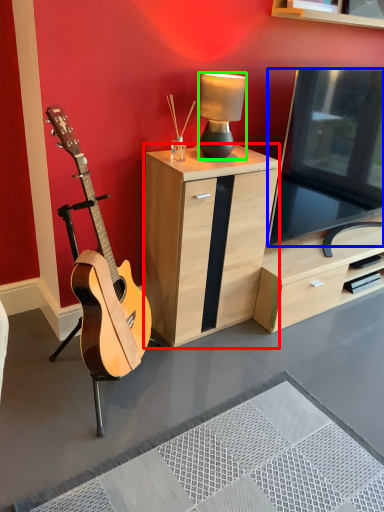
Question: Considering the real-world distances, which object is farthest from cabinetry (highlighted by a red box)? television (highlighted by a blue box) or lamp (highlighted by a green box)?

Choices:
 (A) television
 (B) lamp

Answer: (A)